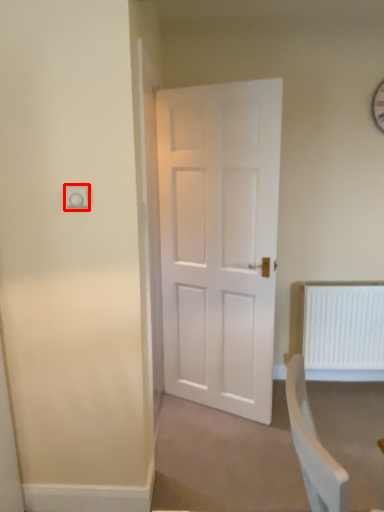
Question: Considering the relative positions of electric outlet (annotated by the red box) and radiator in the image provided, where is electric outlet (annotated by the red box) located with respect to the staircase?

Choices:
 (A) left
 (B) right

Answer: (A)